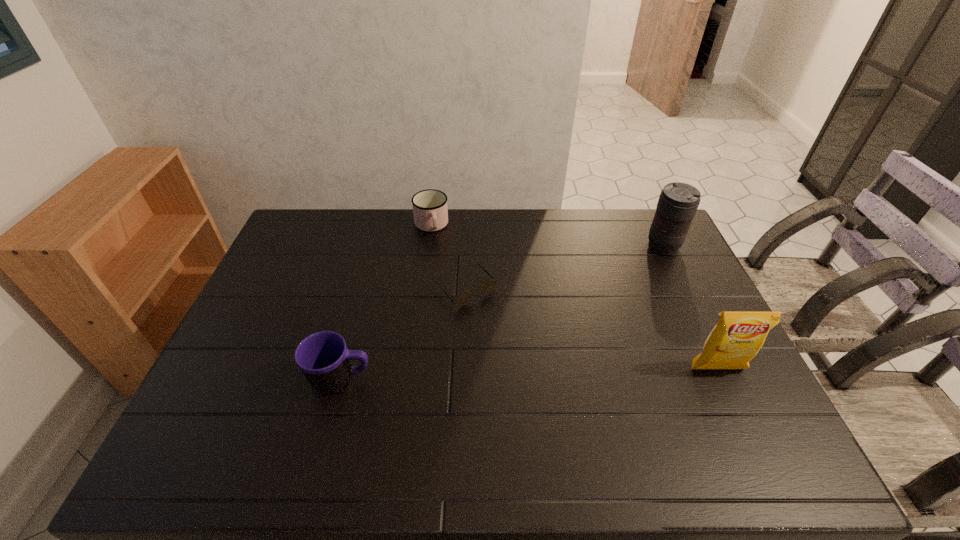
Identify the location of mug located in the far edge section of the desktop. This screenshot has height=540, width=960. (430, 210).

The height and width of the screenshot is (540, 960). Identify the location of object that is positioned at the near edge. (323, 357).

At what (x,y) coordinates should I click in order to perform the action: click on crisp (potato chip) present at the right edge. Please return your answer as a coordinate pair (x, y). Looking at the image, I should click on (738, 336).

You are a GUI agent. You are given a task and a screenshot of the screen. Output one action in this format:
    pyautogui.click(x=<x>, y=<y>)
    Task: Click on the telephoto lens at the right edge
    The image size is (960, 540).
    Given the screenshot: What is the action you would take?
    tap(678, 202)

This screenshot has width=960, height=540. I want to click on object that is at the far right corner, so click(678, 202).

Locate an element on the screen. This screenshot has height=540, width=960. vacant space at the far edge is located at coordinates (373, 238).

The image size is (960, 540). In order to click on free space at the near edge of the desktop in this screenshot , I will do `click(446, 400)`.

This screenshot has width=960, height=540. Find the location of `free space at the left edge of the desktop`. free space at the left edge of the desktop is located at coordinates pos(274,281).

You are a GUI agent. You are given a task and a screenshot of the screen. Output one action in this format:
    pyautogui.click(x=<x>, y=<y>)
    Task: Click on the vacant space at the right edge of the desktop
    The height and width of the screenshot is (540, 960).
    Given the screenshot: What is the action you would take?
    pyautogui.click(x=747, y=388)

Locate an element on the screen. vacant space at the near left corner of the desktop is located at coordinates (188, 420).